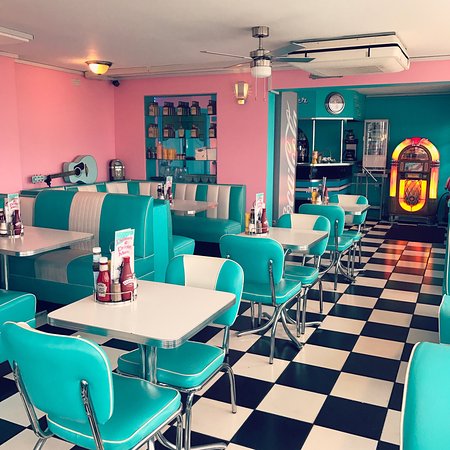
Where is `ceiling fan`? The height and width of the screenshot is (450, 450). ceiling fan is located at coordinates (263, 54).